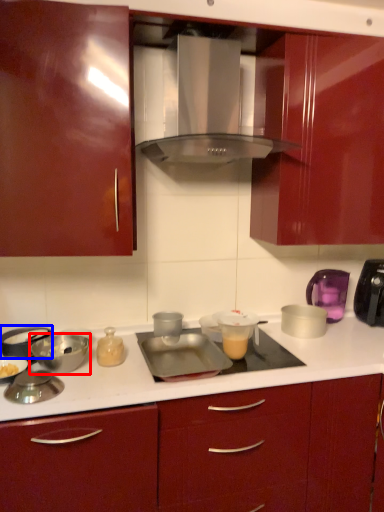
Question: Among these objects, which one is nearest to the camera, bowl (highlighted by a red box) or appliance (highlighted by a blue box)?

Choices:
 (A) bowl
 (B) appliance

Answer: (A)